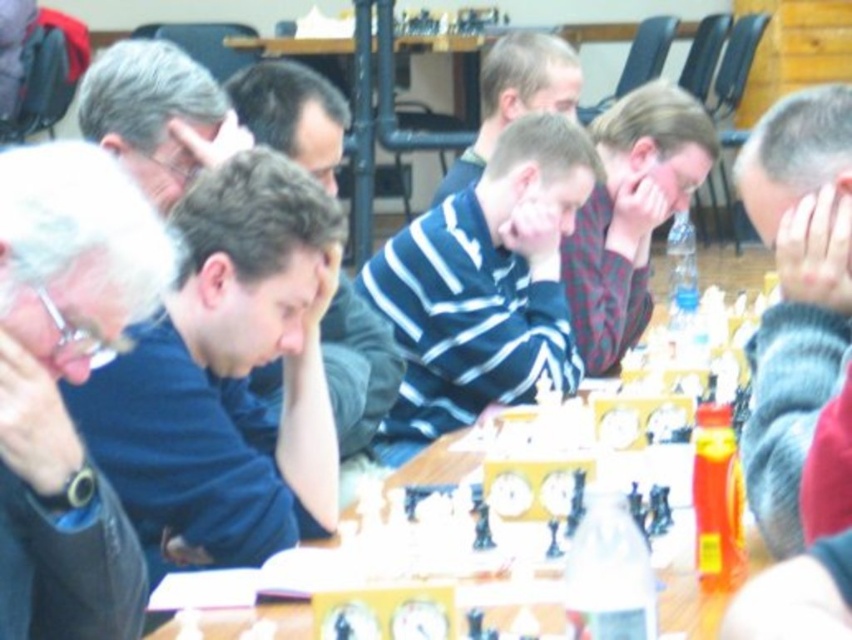
Question: Which object is positioned closest to the wooden at center?

Choices:
 (A) blue striped sweater at center
 (B) plaid fabric shirt at center
 (C) gray knitted sweater at right
 (D) striped cotton shirt at center

Answer: (A)

Question: Among these objects, which one is farthest from the camera?

Choices:
 (A) striped sweater at center
 (B) plaid fabric shirt at center

Answer: (A)

Question: Considering the relative positions of dark blue shirt at center and striped sweater at center in the image provided, where is dark blue shirt at center located with respect to striped sweater at center?

Choices:
 (A) right
 (B) left

Answer: (B)

Question: Does dark blue shirt at center come behind gray knitted sweater at right?

Choices:
 (A) yes
 (B) no

Answer: (A)

Question: Does striped cotton shirt at center appear on the right side of gray knitted sweater at right?

Choices:
 (A) yes
 (B) no

Answer: (B)

Question: Among these points, which one is farthest from the camera?

Choices:
 (A) (65, 413)
 (B) (93, 454)
 (C) (583, 346)

Answer: (C)